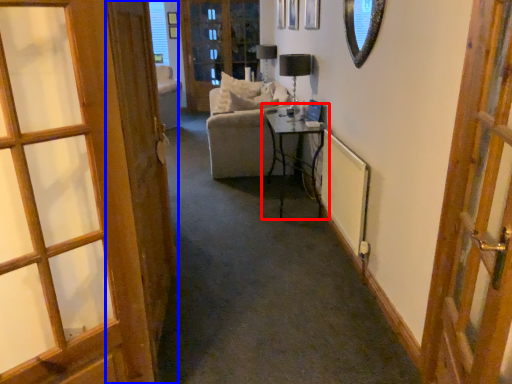
Question: Which of the following is the farthest to the observer, table (highlighted by a red box) or door (highlighted by a blue box)?

Choices:
 (A) table
 (B) door

Answer: (A)